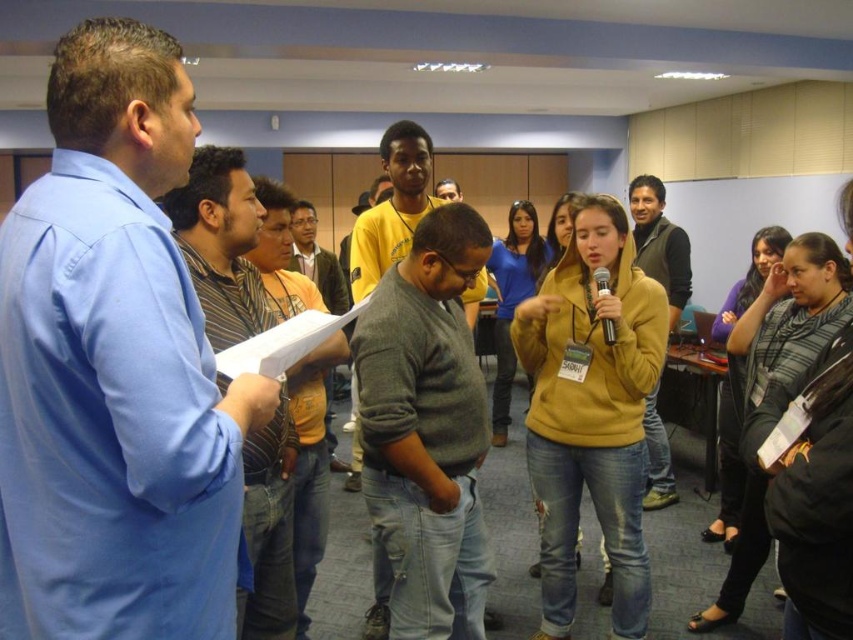
Can you confirm if mustard yellow hoodie at center is shorter than dark gray sweater at center?

In fact, mustard yellow hoodie at center may be taller than dark gray sweater at center.

Who is higher up, mustard yellow hoodie at center or dark gray sweater at center?

dark gray sweater at center is above.

Who is more forward, [567,371] or [659,435]?

Point [567,371]

Locate an element on the screen. mustard yellow hoodie at center is located at coordinates (590, 412).

Does gray sweater at center appear under dark gray sweater at center?

No, gray sweater at center is not below dark gray sweater at center.

Which is behind, point (409, 156) or point (674, 499)?

The point (674, 499) is behind.

In order to click on gray sweater at center in this screenshot , I will do `click(392, 205)`.

Between yellow sweater at center and black plastic microphone at center, which one has more height?

Standing taller between the two is yellow sweater at center.

Which is above, yellow sweater at center or black plastic microphone at center?

yellow sweater at center

Describe the element at coordinates (317, 259) in the screenshot. I see `yellow sweater at center` at that location.

This screenshot has width=853, height=640. I want to click on yellow sweater at center, so click(x=317, y=259).